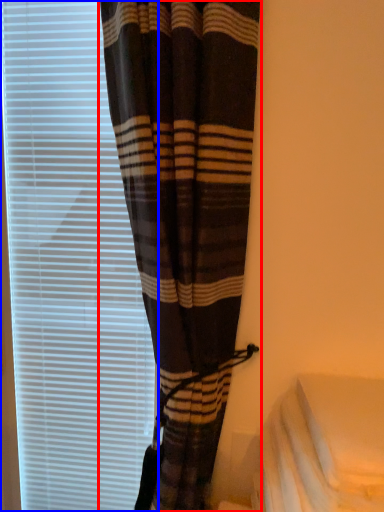
Question: Which of the following is the farthest to the observer, curtain (highlighted by a red box) or window blind (highlighted by a blue box)?

Choices:
 (A) curtain
 (B) window blind

Answer: (B)